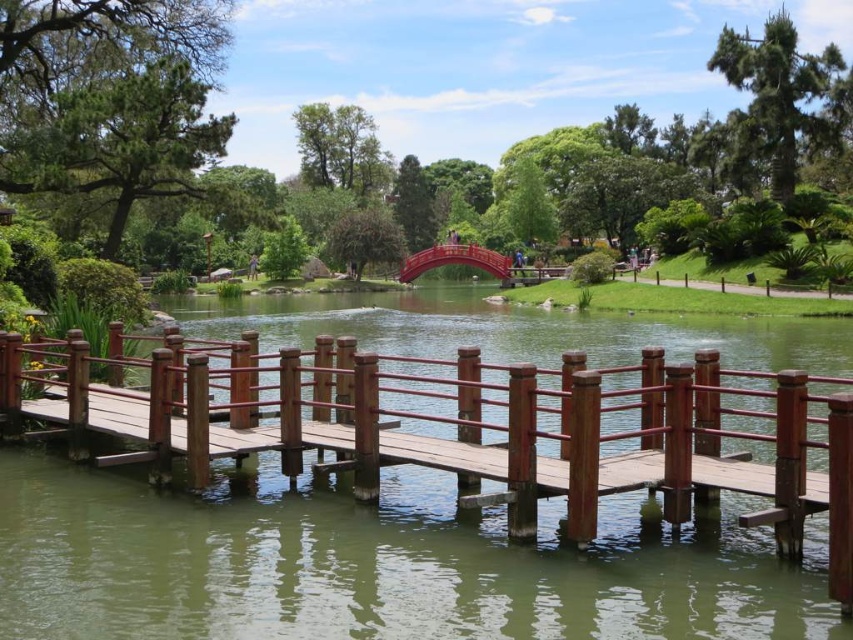
Question: Can you confirm if wooden dock at center is wider than shiny red bridge at center?

Choices:
 (A) no
 (B) yes

Answer: (B)

Question: Does wooden dock at center come behind shiny red bridge at center?

Choices:
 (A) yes
 (B) no

Answer: (B)

Question: Considering the relative positions of wooden dock at center and shiny red bridge at center in the image provided, where is wooden dock at center located with respect to shiny red bridge at center?

Choices:
 (A) above
 (B) below

Answer: (B)

Question: Which of the following is the closest to the observer?

Choices:
 (A) shiny red bridge at center
 (B) wooden dock at center

Answer: (B)

Question: Which point is closer to the camera?

Choices:
 (A) shiny red bridge at center
 (B) wooden dock at center

Answer: (B)